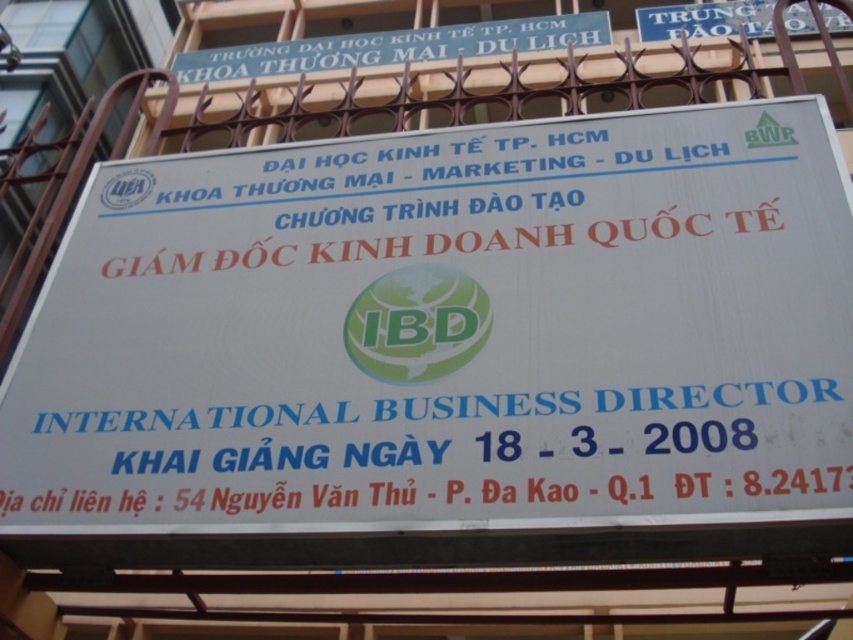
Question: Among these objects, which one is farthest from the camera?

Choices:
 (A) white paper sign at center
 (B) blue plastic signboard at upper center

Answer: (B)

Question: Which object is closer to the camera taking this photo?

Choices:
 (A) white paper sign at center
 (B) blue plastic signboard at upper center

Answer: (A)

Question: Does white paper sign at center appear on the left side of blue plastic signboard at upper center?

Choices:
 (A) no
 (B) yes

Answer: (A)

Question: Is white paper sign at center closer to the viewer compared to blue plastic signboard at upper center?

Choices:
 (A) no
 (B) yes

Answer: (B)

Question: Among these points, which one is farthest from the camera?

Choices:
 (A) (328, 56)
 (B) (318, 161)

Answer: (A)

Question: Is white paper sign at center wider than blue plastic signboard at upper center?

Choices:
 (A) yes
 (B) no

Answer: (B)